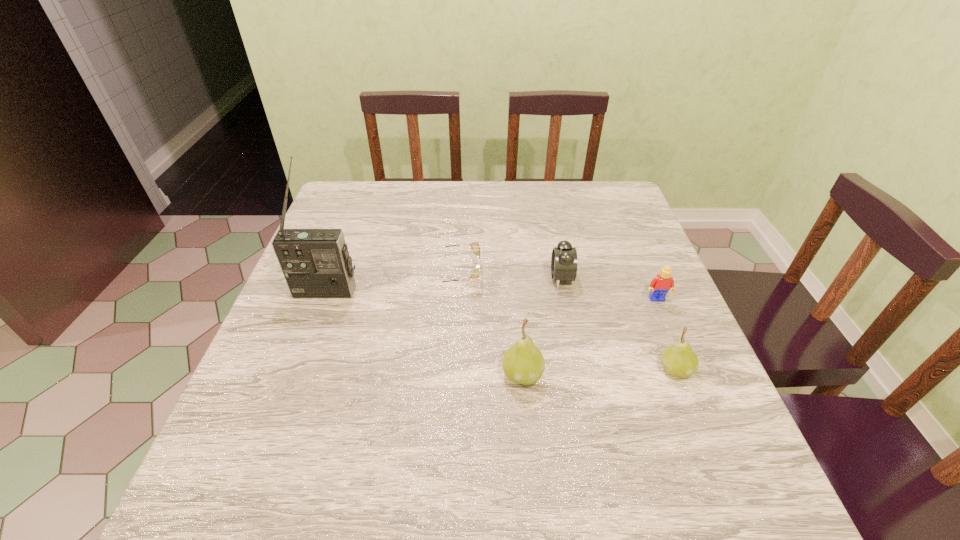
Find the location of `free space in the image that satisfies the following two spatial constraints: 1. on the front lenses of the shortest object; 2. on the display of the tallest object`. free space in the image that satisfies the following two spatial constraints: 1. on the front lenses of the shortest object; 2. on the display of the tallest object is located at coordinates (455, 292).

Where is `free space that satisfies the following two spatial constraints: 1. on the front side of the alarm clock; 2. on the back side of the shorter pear`? This screenshot has width=960, height=540. free space that satisfies the following two spatial constraints: 1. on the front side of the alarm clock; 2. on the back side of the shorter pear is located at coordinates (580, 369).

You are a GUI agent. You are given a task and a screenshot of the screen. Output one action in this format:
    pyautogui.click(x=<x>, y=<y>)
    Task: Click on the vacant point that satisfies the following two spatial constraints: 1. on the front lenses of the right pear; 2. on the left side of the second object from left to right
    Image resolution: width=960 pixels, height=540 pixels.
    Given the screenshot: What is the action you would take?
    pyautogui.click(x=450, y=369)

Where is `free point that satisfies the following two spatial constraints: 1. on the front side of the alarm clock; 2. on the display of the leftmost object`? free point that satisfies the following two spatial constraints: 1. on the front side of the alarm clock; 2. on the display of the leftmost object is located at coordinates (564, 292).